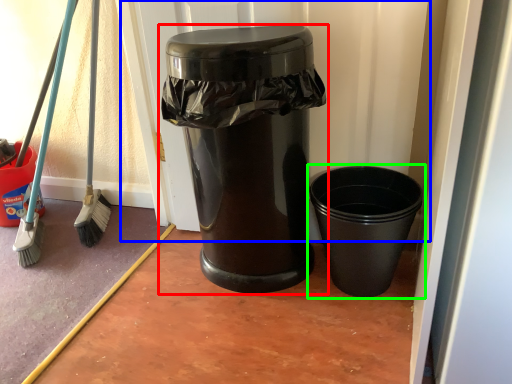
Question: Which is nearer to the waste container (highlighted by a red box)? screen door (highlighted by a blue box) or waste container (highlighted by a green box).

Choices:
 (A) screen door
 (B) waste container

Answer: (A)